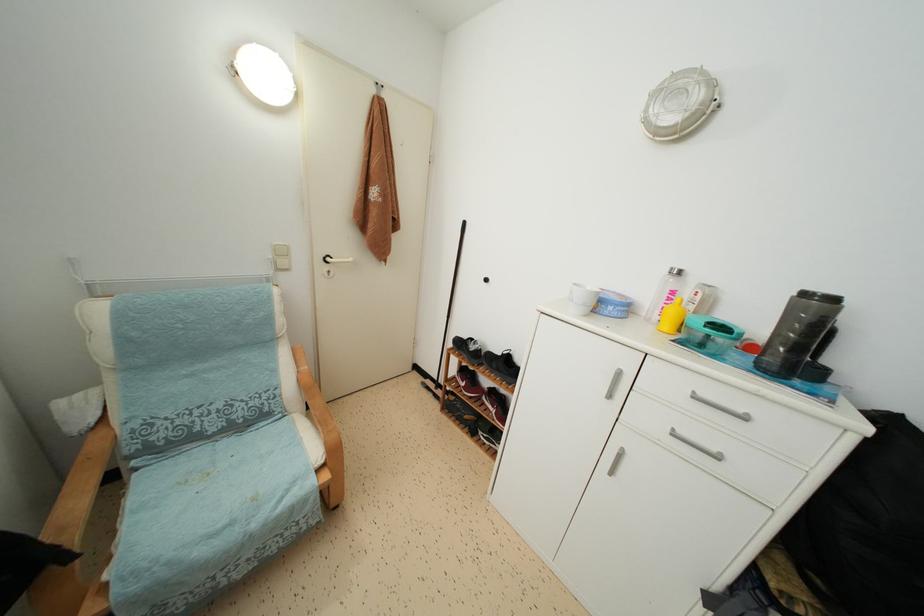
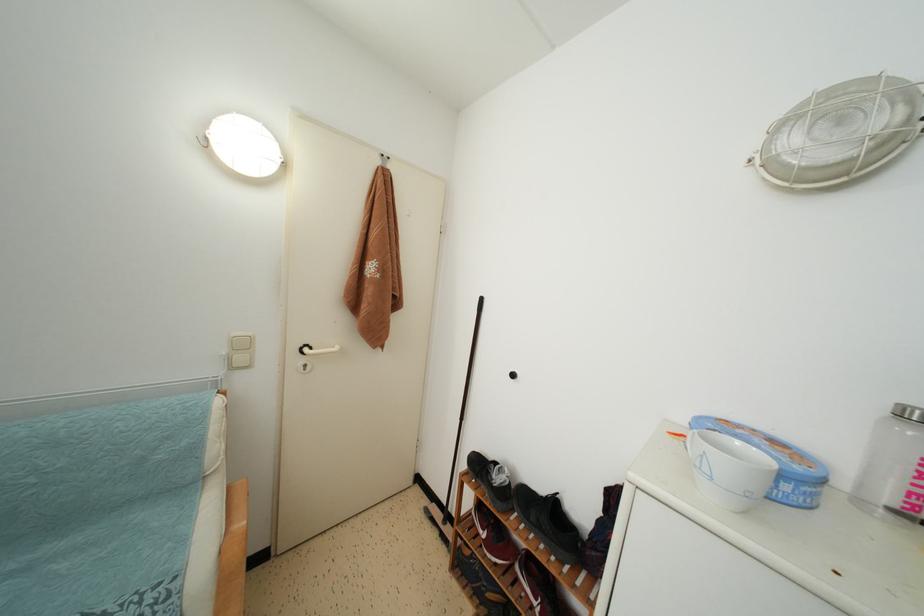
Question: The images are taken continuously from a first-person perspective. In which direction are you moving?

Choices:
 (A) Left
 (B) Right
 (C) Forward
 (D) Backward

Answer: (C)